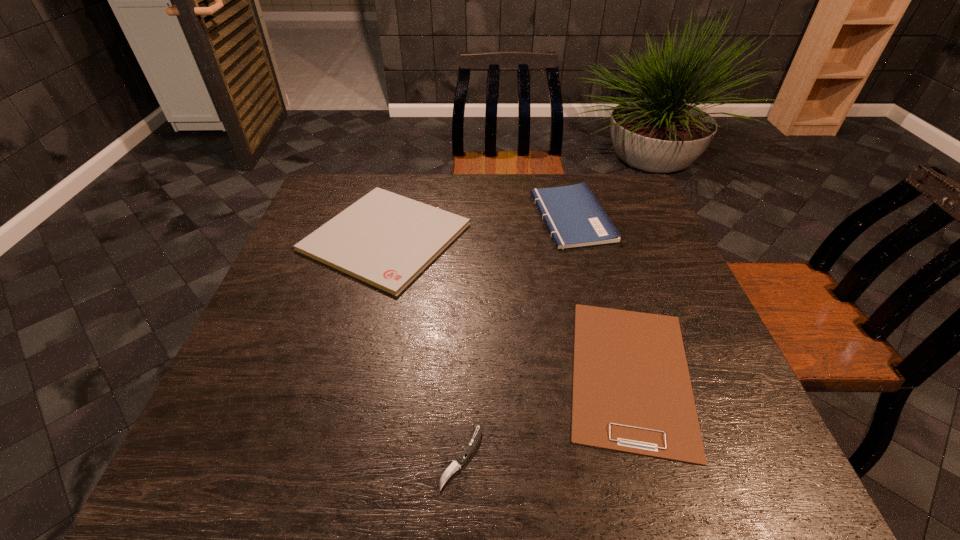
Where is `vacant point that satisfies the following two spatial constraints: 1. on the front side of the second tallest object; 2. on the left side of the pocketknife`? This screenshot has height=540, width=960. vacant point that satisfies the following two spatial constraints: 1. on the front side of the second tallest object; 2. on the left side of the pocketknife is located at coordinates (330, 456).

This screenshot has height=540, width=960. What are the coordinates of `free location that satisfies the following two spatial constraints: 1. on the front side of the nearer clipboard; 2. on the right side of the left clipboard` in the screenshot? It's located at (350, 373).